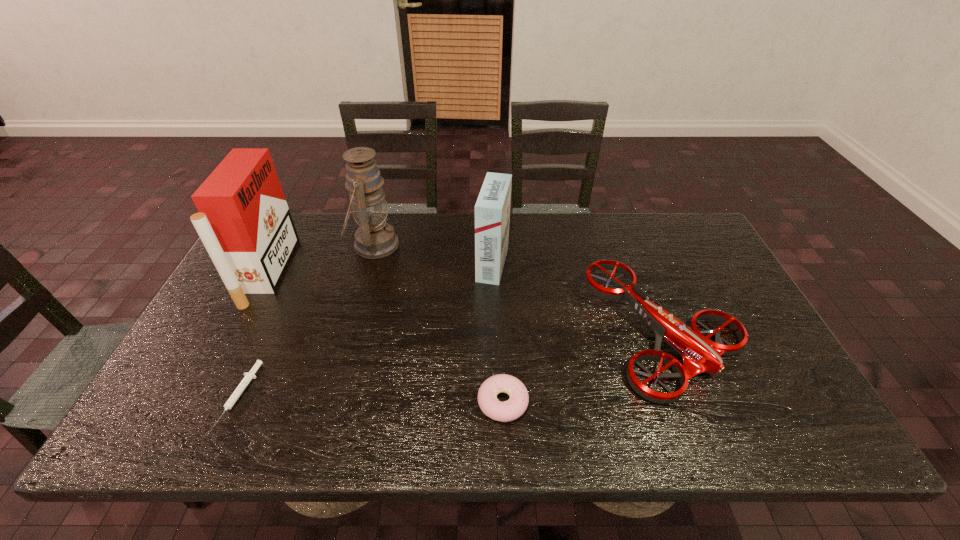
This screenshot has width=960, height=540. What are the coordinates of `vacant space that is in between the shorter cigarette case and the oil lamp` in the screenshot? It's located at (433, 254).

The height and width of the screenshot is (540, 960). I want to click on free spot between the rightmost object and the third tallest object, so 579,299.

Identify the location of empty space between the syringe and the third tallest object. The width and height of the screenshot is (960, 540). (367, 329).

Image resolution: width=960 pixels, height=540 pixels. In order to click on empty space that is in between the shortest object and the right cigarette case in this screenshot , I will do click(367, 329).

You are a GUI agent. You are given a task and a screenshot of the screen. Output one action in this format:
    pyautogui.click(x=<x>, y=<y>)
    Task: Click on the vacant area that lies between the taller cigarette case and the syringe
    This screenshot has height=540, width=960.
    Given the screenshot: What is the action you would take?
    pyautogui.click(x=254, y=333)

Locate an element on the screen. This screenshot has width=960, height=540. free spot between the shortest object and the third shortest object is located at coordinates 453,364.

At what (x,y) coordinates should I click in order to perform the action: click on free space between the fifth tallest object and the rightmost object. Please return your answer as a coordinate pair (x, y). This screenshot has width=960, height=540. Looking at the image, I should click on (585, 367).

You are a GUI agent. You are given a task and a screenshot of the screen. Output one action in this format:
    pyautogui.click(x=<x>, y=<y>)
    Task: Click on the free space between the third object from left to right and the taller cigarette case
    
    Given the screenshot: What is the action you would take?
    pyautogui.click(x=322, y=259)

Identify which object is located as the third nearest to the shorter cigarette case. Please provide its 2D coordinates. Your answer should be formatted as a tuple, i.e. [(x, y)], where the tuple contains the x and y coordinates of a point satisfying the conditions above.

[(509, 410)]

Identify which object is located as the fifth nearest to the drone. Please provide its 2D coordinates. Your answer should be formatted as a tuple, i.e. [(x, y)], where the tuple contains the x and y coordinates of a point satisfying the conditions above.

[(244, 222)]